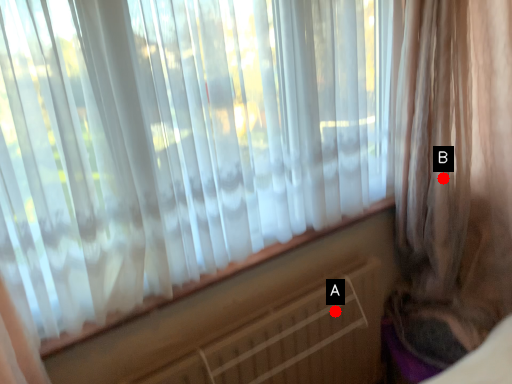
Question: Two points are circled on the image, labeled by A and B beside each circle. Which of the following is the farthest from the observer?

Choices:
 (A) A is further
 (B) B is further

Answer: (A)